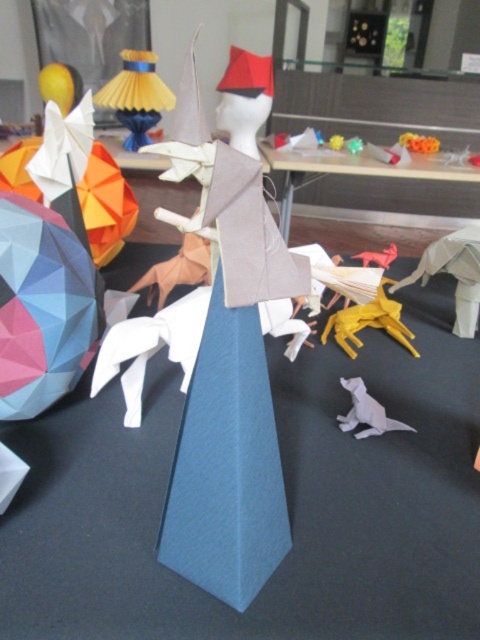
Question: Is wooden table at center above yellow paper horse at center?

Choices:
 (A) yes
 (B) no

Answer: (A)

Question: Which point is farther to the camera?

Choices:
 (A) (290, 179)
 (B) (367, 304)

Answer: (A)

Question: Which object is closer to the camera taking this photo?

Choices:
 (A) yellow paper horse at center
 (B) wooden table at center

Answer: (A)

Question: Is wooden table at center to the left of yellow paper horse at center from the viewer's perspective?

Choices:
 (A) no
 (B) yes

Answer: (A)

Question: Does wooden table at center appear on the right side of yellow paper horse at center?

Choices:
 (A) no
 (B) yes

Answer: (B)